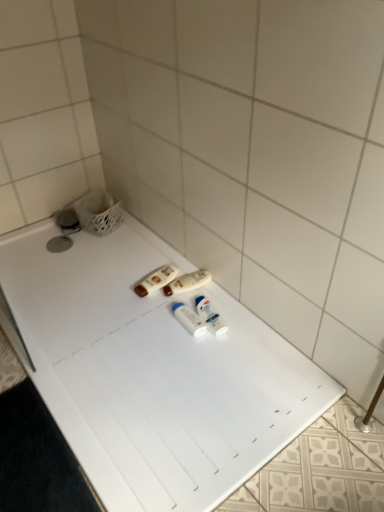
This screenshot has width=384, height=512. I want to click on vacant space behind brown plastic lotion at center, the first toiletry in the left-to-right sequence, so click(147, 259).